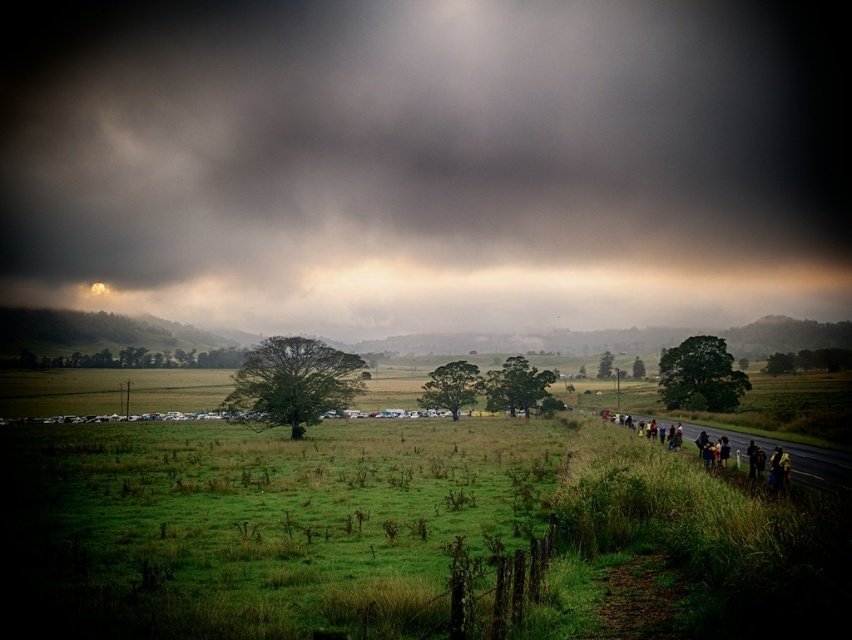
Is dark gray cloud at upper center below yellow fabric people at lower right?

No, dark gray cloud at upper center is not below yellow fabric people at lower right.

Who is taller, dark gray cloud at upper center or yellow fabric people at lower right?

dark gray cloud at upper center is taller.

Between point (764, 189) and point (704, 456), which one is positioned behind?

Positioned behind is point (764, 189).

Where is `dark gray cloud at upper center`? dark gray cloud at upper center is located at coordinates (427, 161).